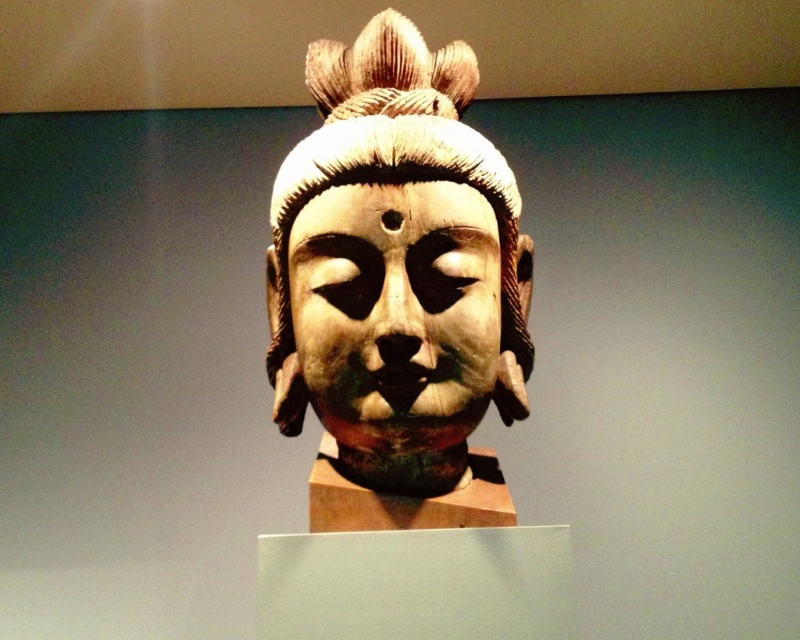
Question: Can you confirm if wooden statue at center is smaller than wooden textured headdress at center?

Choices:
 (A) yes
 (B) no

Answer: (B)

Question: Is matte wood mask at center smaller than wooden textured headdress at center?

Choices:
 (A) yes
 (B) no

Answer: (A)

Question: Among these points, which one is farthest from the camera?

Choices:
 (A) (428, 376)
 (B) (468, 362)
 (C) (374, 22)

Answer: (C)

Question: Which point is farther from the camera taking this photo?

Choices:
 (A) (518, 333)
 (B) (288, 365)

Answer: (A)

Question: Does matte wood mask at center appear under wooden textured headdress at center?

Choices:
 (A) yes
 (B) no

Answer: (A)

Question: Which object is closer to the camera taking this photo?

Choices:
 (A) matte wood mask at center
 (B) wooden statue at center
 (C) wooden textured headdress at center

Answer: (A)